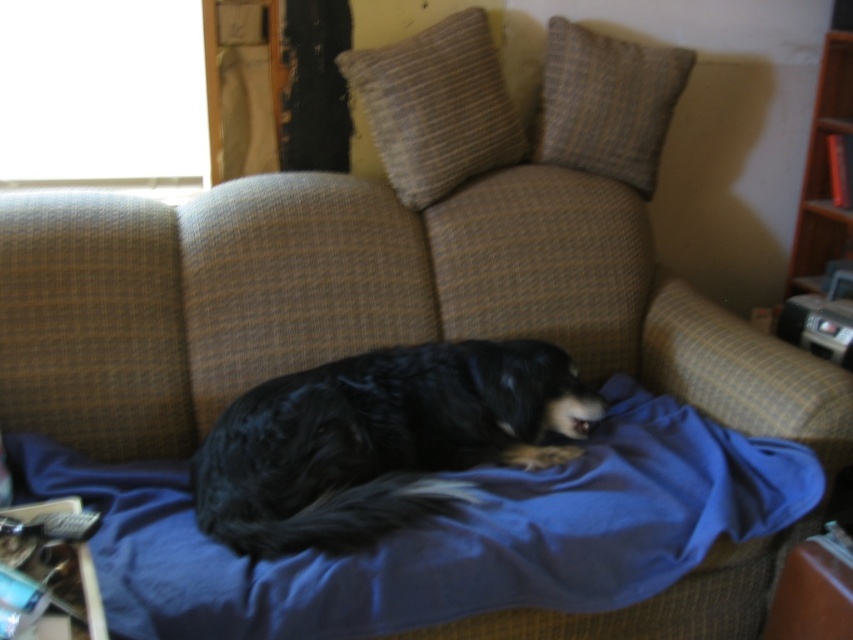
Question: Which object appears farthest from the camera in this image?

Choices:
 (A) blue fabric blanket at center
 (B) black fur dog at center
 (C) textured beige pillow at upper center

Answer: (C)

Question: Among these objects, which one is farthest from the camera?

Choices:
 (A) textured beige pillow at upper right
 (B) textured beige pillow at upper center

Answer: (A)

Question: Is blue fabric blanket at center below textured beige pillow at upper center?

Choices:
 (A) no
 (B) yes

Answer: (B)

Question: Can you confirm if black fur dog at center is positioned to the right of textured beige pillow at upper right?

Choices:
 (A) no
 (B) yes

Answer: (A)

Question: Which of the following is the farthest from the observer?

Choices:
 (A) (323, 483)
 (B) (537, 550)

Answer: (A)

Question: Is textured beige pillow at upper right above wooden bookshelf at right?

Choices:
 (A) no
 (B) yes

Answer: (B)